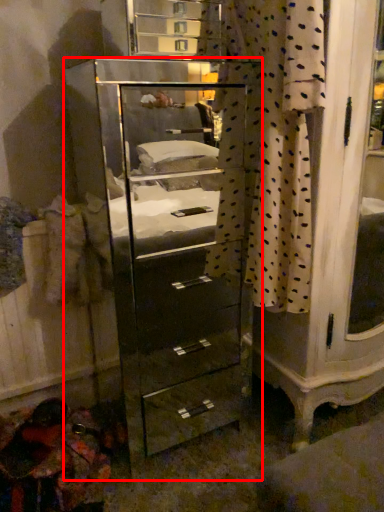
Question: From the image's perspective, where is chest of drawers (annotated by the red box) located in relation to curtain in the image?

Choices:
 (A) below
 (B) above

Answer: (A)